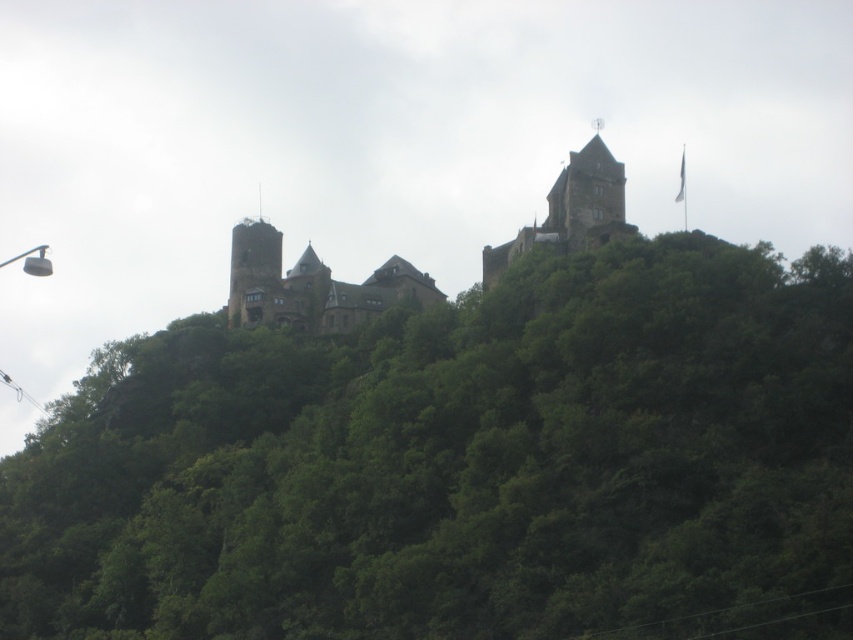
Question: Which point is farther from the camera taking this photo?

Choices:
 (A) (442, 602)
 (B) (567, 164)

Answer: (B)

Question: Which point is farther to the camera?

Choices:
 (A) (244, 230)
 (B) (109, 556)

Answer: (A)

Question: Can you confirm if green leafy tree at upper center is wider than brown stone castle at center?

Choices:
 (A) no
 (B) yes

Answer: (B)

Question: Is green leafy tree at upper center to the right of brown stone castle at center from the viewer's perspective?

Choices:
 (A) no
 (B) yes

Answer: (A)

Question: Is green leafy tree at upper center positioned before brown stone castle at center?

Choices:
 (A) no
 (B) yes

Answer: (B)